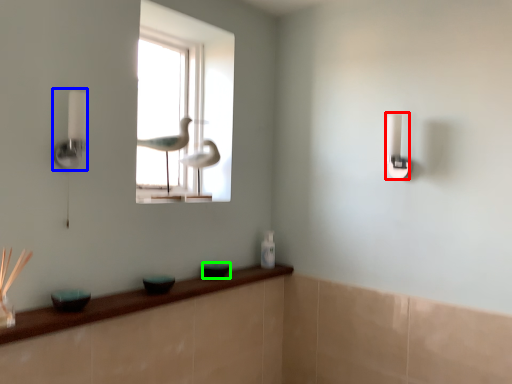
Question: Based on their relative distances, which object is nearer to light switch (highlighted by a red box)? Choose from lamp (highlighted by a blue box) and glass bowl (highlighted by a green box).

Choices:
 (A) lamp
 (B) glass bowl

Answer: (B)